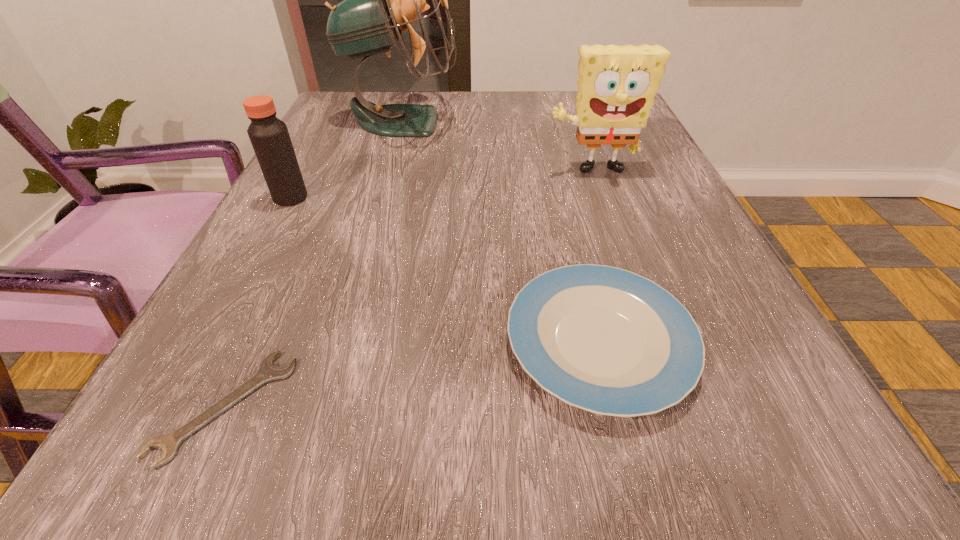
In order to click on free space between the farthest object and the fourth tallest object in this screenshot , I will do `click(501, 232)`.

Image resolution: width=960 pixels, height=540 pixels. I want to click on vacant space that's between the shortest object and the second farthest object, so click(x=408, y=289).

I want to click on empty location between the second tallest object and the third shortest object, so click(441, 185).

Locate an element on the screen. This screenshot has height=540, width=960. empty location between the third nearest object and the tallest object is located at coordinates (347, 159).

Image resolution: width=960 pixels, height=540 pixels. Find the location of `vacant point located between the second farthest object and the plate`. vacant point located between the second farthest object and the plate is located at coordinates (595, 258).

Identify the location of vacant space that is in between the tallest object and the fourth tallest object. The image size is (960, 540). (501, 232).

Locate an element on the screen. This screenshot has height=540, width=960. free point between the plate and the vinegar is located at coordinates (444, 271).

This screenshot has width=960, height=540. What are the coordinates of `empty space between the fan and the third farthest object` in the screenshot? It's located at (347, 159).

Where is `object that stands as the closest to the farthest object`? The image size is (960, 540). object that stands as the closest to the farthest object is located at coordinates (269, 136).

Identify which object is the closest to the third farthest object. Please provide its 2D coordinates. Your answer should be formatted as a tuple, i.e. [(x, y)], where the tuple contains the x and y coordinates of a point satisfying the conditions above.

[(380, 0)]